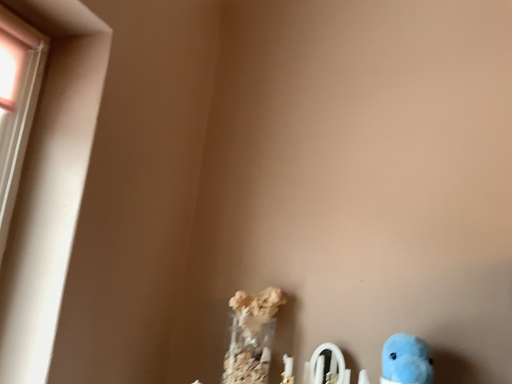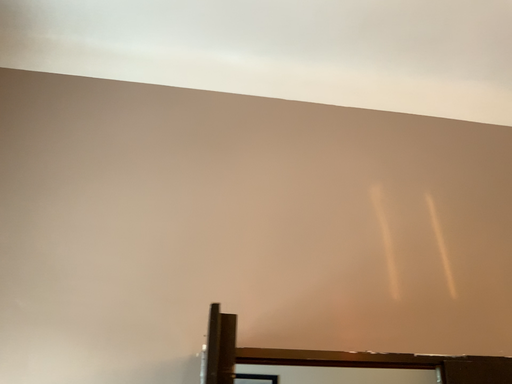
Question: Which way did the camera rotate in the video?

Choices:
 (A) rotated upward
 (B) rotated downward

Answer: (A)